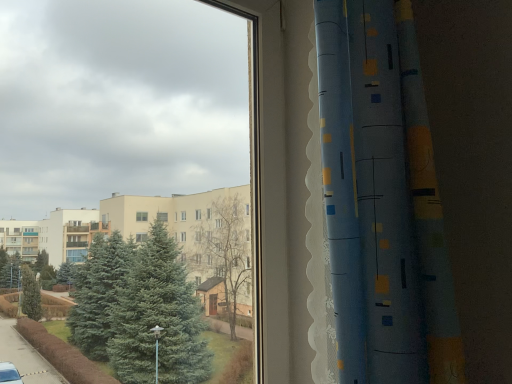
The height and width of the screenshot is (384, 512). What do you see at coordinates (382, 200) in the screenshot? I see `blue fabric curtain at right` at bounding box center [382, 200].

This screenshot has height=384, width=512. Identify the location of blue fabric curtain at right. (382, 200).

Measure the distance between blue fabric curtain at right and camera.

32.12 inches.

At what (x,y) coordinates should I click in order to perform the action: click on blue fabric curtain at right. Please return your answer as a coordinate pair (x, y). The image size is (512, 384). Looking at the image, I should click on (382, 200).